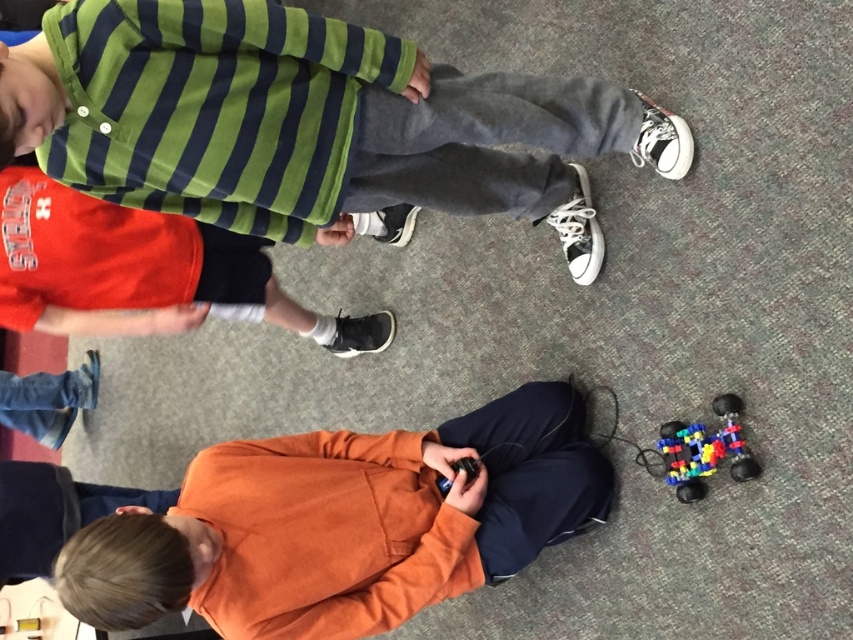
Question: Which object appears closest to the camera in this image?

Choices:
 (A) matte black shorts at lower left
 (B) multicolored plastic toy car at lower right

Answer: (B)

Question: Which point is farther from the camera taking this photo?

Choices:
 (A) (733, 417)
 (B) (364, 621)
 (C) (225, 259)
 (D) (303, 24)

Answer: (C)

Question: Does matte green striped shirt at upper left lie in front of matte black shorts at lower left?

Choices:
 (A) yes
 (B) no

Answer: (A)

Question: Observing the image, what is the correct spatial positioning of orange fleece shirt at lower center in reference to multicolored plastic toy car at lower right?

Choices:
 (A) left
 (B) right

Answer: (A)

Question: Can you confirm if matte black shorts at lower left is positioned above multicolored plastic toy car at lower right?

Choices:
 (A) yes
 (B) no

Answer: (A)

Question: Which object is the farthest from the orange fleece shirt at lower center?

Choices:
 (A) multicolored plastic toy car at lower right
 (B) matte black shorts at lower left
 (C) matte green striped shirt at upper left

Answer: (B)